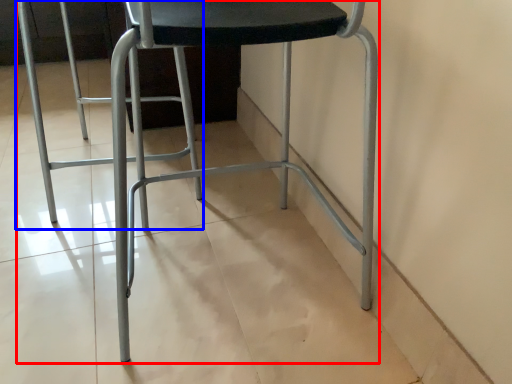
Question: Which point is further to the camera, chair (highlighted by a red box) or swivel chair (highlighted by a blue box)?

Choices:
 (A) chair
 (B) swivel chair

Answer: (B)